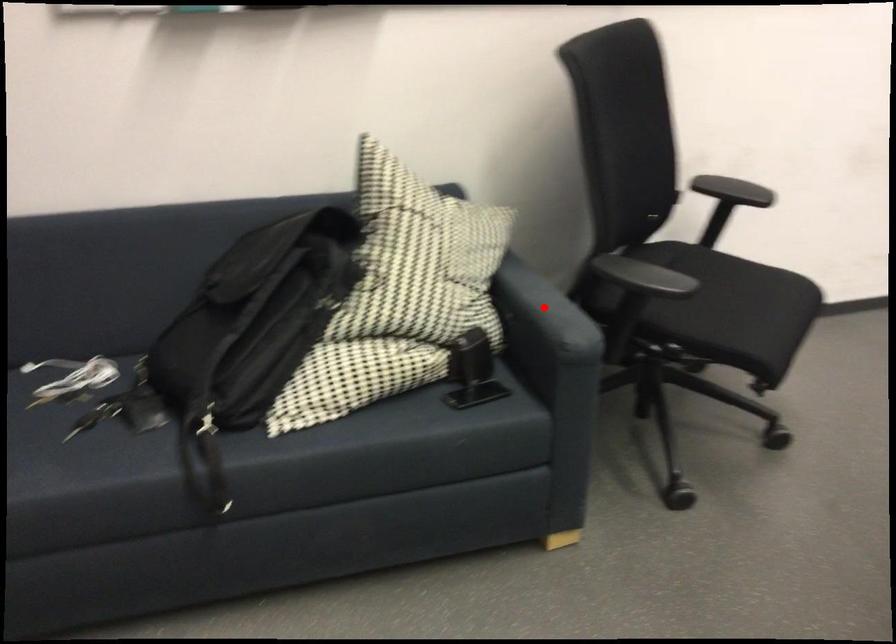
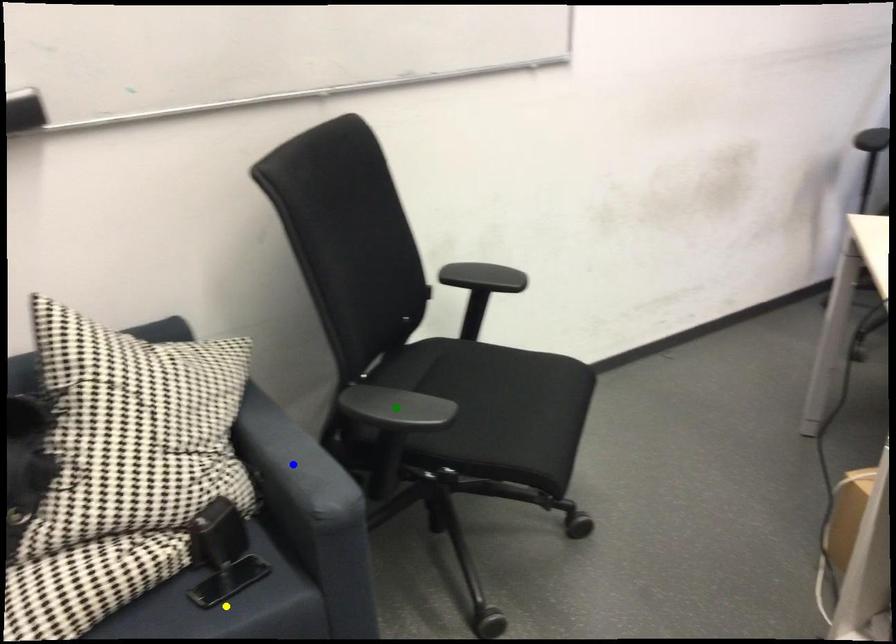
Question: I am providing you with two images of the same scene from different viewpoints. A red point is marked on the first image. You are given multiple points on the second image. In image 2, which mark is for the same physical point as the one in image 1?

Choices:
 (A) green point
 (B) blue point
 (C) yellow point

Answer: (B)